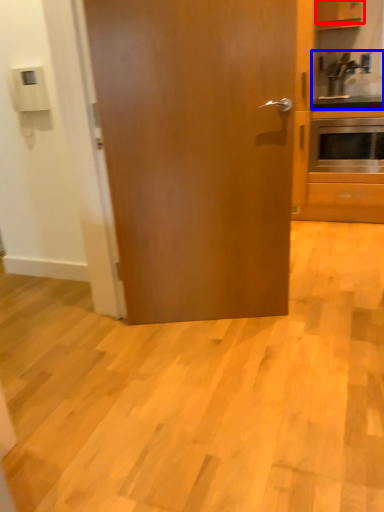
Question: Which point is further to the camera, cabinetry (highlighted by a red box) or sink (highlighted by a blue box)?

Choices:
 (A) cabinetry
 (B) sink

Answer: (B)